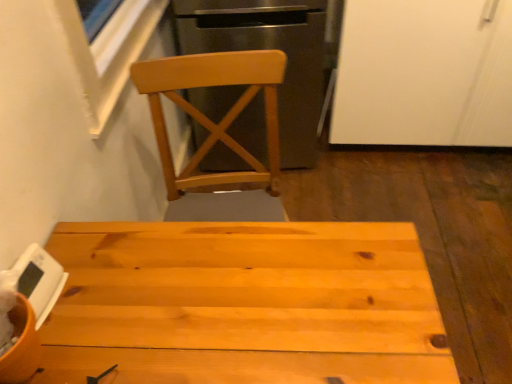
Question: Based on their sizes in the image, would you say natural wood table at center is bigger or smaller than white matte cabinet at upper right?

Choices:
 (A) big
 (B) small

Answer: (B)

Question: Considering the positions of natural wood table at center and white matte cabinet at upper right in the image, is natural wood table at center taller or shorter than white matte cabinet at upper right?

Choices:
 (A) tall
 (B) short

Answer: (B)

Question: Considering the real-world distances, which object is closest to the white matte digital clock at lower left?

Choices:
 (A) white matte cabinet at upper right
 (B) light wood chair at upper center
 (C) natural wood table at center

Answer: (C)

Question: Which of these objects is positioned closest to the light wood chair at upper center?

Choices:
 (A) white matte digital clock at lower left
 (B) natural wood table at center
 (C) white matte cabinet at upper right

Answer: (C)